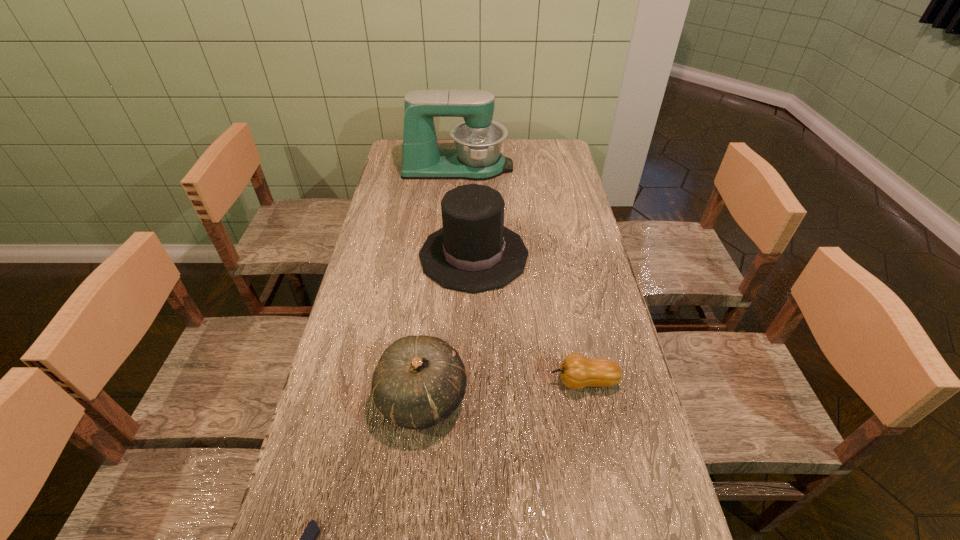
I want to click on free space at the left edge, so click(x=355, y=354).

Identify the location of vacant space at the right edge of the desktop. The height and width of the screenshot is (540, 960). (588, 216).

Where is `free space that is in between the right gourd and the left gourd`? The height and width of the screenshot is (540, 960). free space that is in between the right gourd and the left gourd is located at coordinates click(503, 389).

Where is `vacant space that is in between the second shortest object and the taller gourd`? The height and width of the screenshot is (540, 960). vacant space that is in between the second shortest object and the taller gourd is located at coordinates (503, 389).

Identify the location of free area in between the shorter gourd and the dress hat. Image resolution: width=960 pixels, height=540 pixels. (529, 318).

At what (x,y) coordinates should I click in order to perform the action: click on blank region between the shorter gourd and the farthest object. Please return your answer as a coordinate pair (x, y). The height and width of the screenshot is (540, 960). Looking at the image, I should click on (521, 274).

The image size is (960, 540). I want to click on vacant space in between the second shortest object and the left gourd, so click(503, 389).

In order to click on object that ranks as the fourth closest to the second shortest object in this screenshot , I will do `click(478, 140)`.

What are the coordinates of `object that is the closest to the shorter gourd` in the screenshot? It's located at (419, 381).

Identify the location of free region that satisfies the following two spatial constraints: 1. on the stem side of the second shortest object; 2. on the front side of the left gourd. (588, 397).